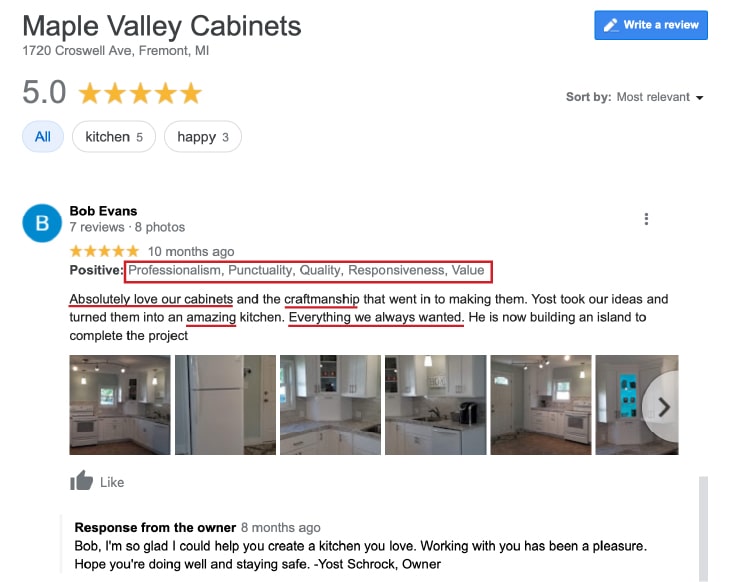
Where is `cabinets`? The image size is (730, 582). cabinets is located at coordinates (539, 421), (553, 421), (417, 435), (339, 438), (320, 438), (366, 445), (117, 429), (131, 429), (146, 431).